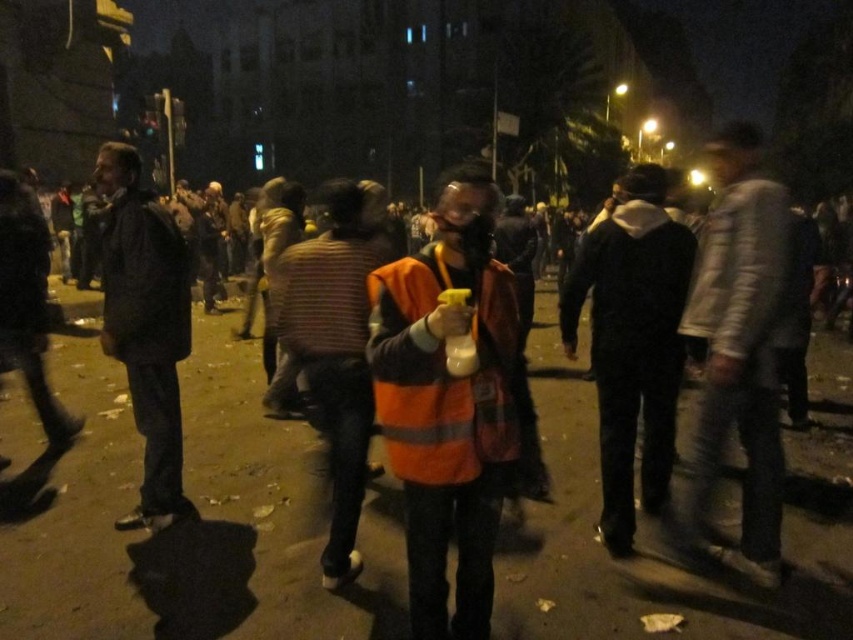
This screenshot has width=853, height=640. Find the location of `reflective orange vest at center`. reflective orange vest at center is located at coordinates (450, 403).

Which is in front, point (430, 412) or point (770, 403)?

Point (430, 412)

The width and height of the screenshot is (853, 640). I want to click on reflective orange vest at center, so click(x=450, y=403).

Find the location of a particular element. The width and height of the screenshot is (853, 640). reflective orange vest at center is located at coordinates (450, 403).

Between point (721, 269) and point (136, 358), which one is positioned behind?

The point (136, 358) is behind.

Is white textured jacket at right to the right of dark matte jacket at left from the viewer's perspective?

Correct, you'll find white textured jacket at right to the right of dark matte jacket at left.

The image size is (853, 640). What do you see at coordinates (738, 353) in the screenshot?
I see `white textured jacket at right` at bounding box center [738, 353].

Locate an element on the screen. Image resolution: width=853 pixels, height=640 pixels. white textured jacket at right is located at coordinates (738, 353).

Can you confirm if reflective orange vest at center is taller than black matte jacket at center?

No, reflective orange vest at center is not taller than black matte jacket at center.

Is reflective orange vest at center above black matte jacket at center?

Incorrect, reflective orange vest at center is not positioned above black matte jacket at center.

Between point (465, 595) and point (650, 278), which one is positioned behind?

Positioned behind is point (650, 278).

The image size is (853, 640). Find the location of `reflective orange vest at center`. reflective orange vest at center is located at coordinates (450, 403).